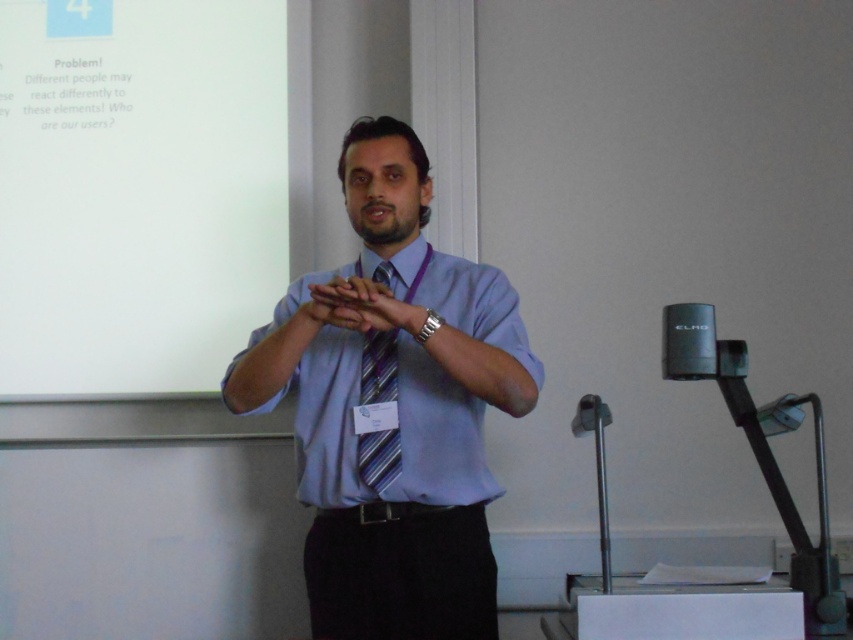
You are a photographer positioned in front of the matte blue shirt at center. Your camera has a focal length of 50mm and you want to capture a portrait where the shirt fills the frame. Given that the shirt is 5.46 feet away, what adjustment should you make to your camera settings to ensure the shirt appears properly framed?

The matte blue shirt at center is 5.46 feet from the viewer. To properly frame it in the portrait, you should adjust your camera settings by either moving closer to the shirt or increasing the focal length beyond 50mm to ensure the shirt fills the frame appropriately.

You are an attendee at a presentation and want to take a photo of the white matte projection screen at upper left. The screen is located at coordinates point 0.297, 0.162. If your phone camera has a 120 degree field of view, can you capture the entire screen in one shot?

The white matte projection screen at upper left is located at point (137, 189). Based on standard camera angles, a 120 degree field of view should be wide enough to capture the entire screen in one shot.